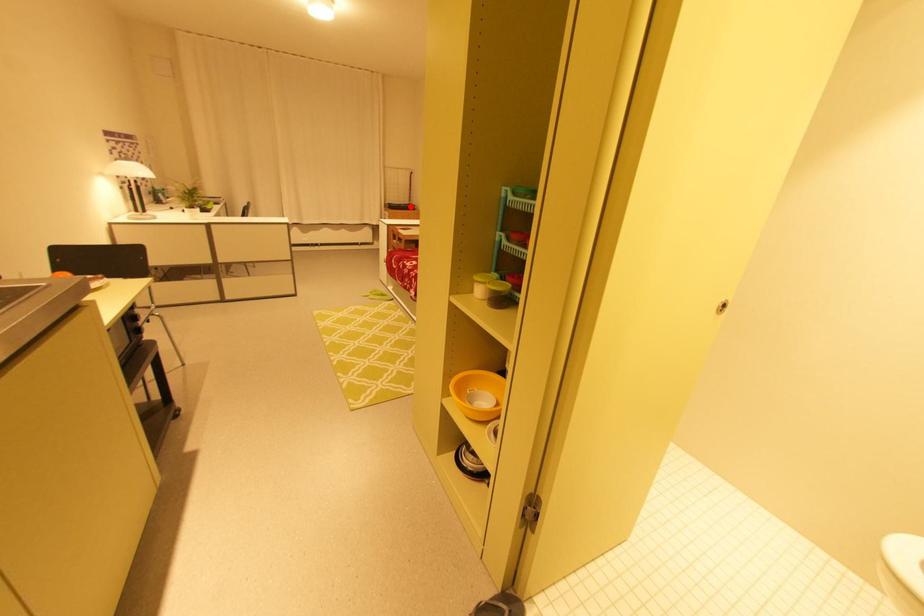
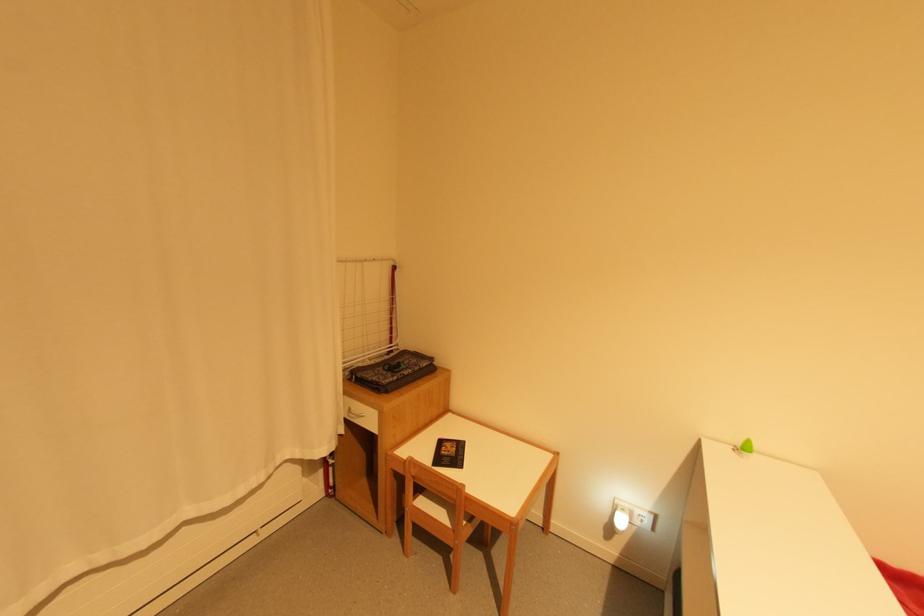
Question: I am providing you with two images of the same scene from different viewpoints. A red point is shown in image1. For the corresponding object point in image2, is it positioned nearer or farther from the camera?

Choices:
 (A) Nearer
 (B) Farther

Answer: (A)